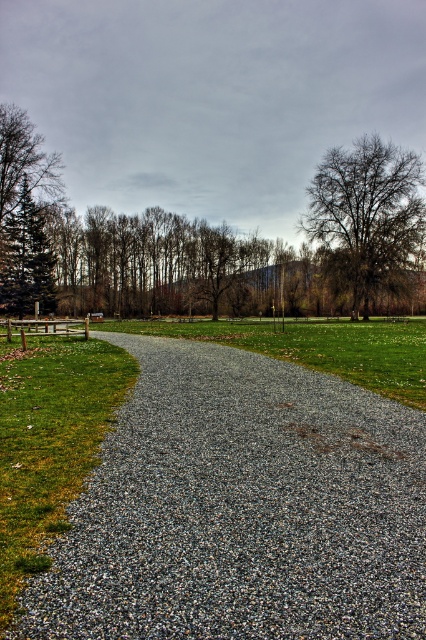
You are standing at the start of the gray gravel path at center and want to reach the green grass at left. Which direction should you move to get there?

The gray gravel path at center is in front of green grass at left, so you should move forward towards the gray gravel path at center to reach the green grass at left.

You are standing on the gravel pathway and looking towards the background trees. Which area of green grass is nearer to you, the green grass at left or the green grassy at center?

The green grass at left is closer to the viewer than the green grassy at center, so the green grass at left is nearer to you.